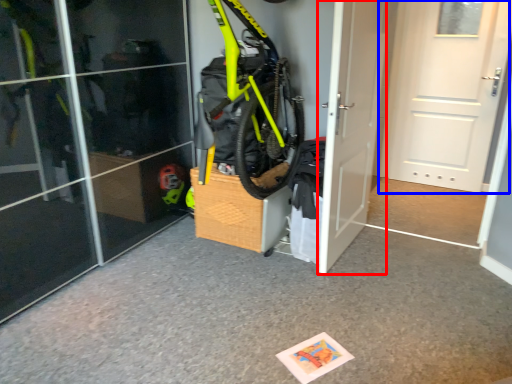
Question: Which object appears closest to the camera in this image, door (highlighted by a red box) or door (highlighted by a blue box)?

Choices:
 (A) door
 (B) door

Answer: (A)